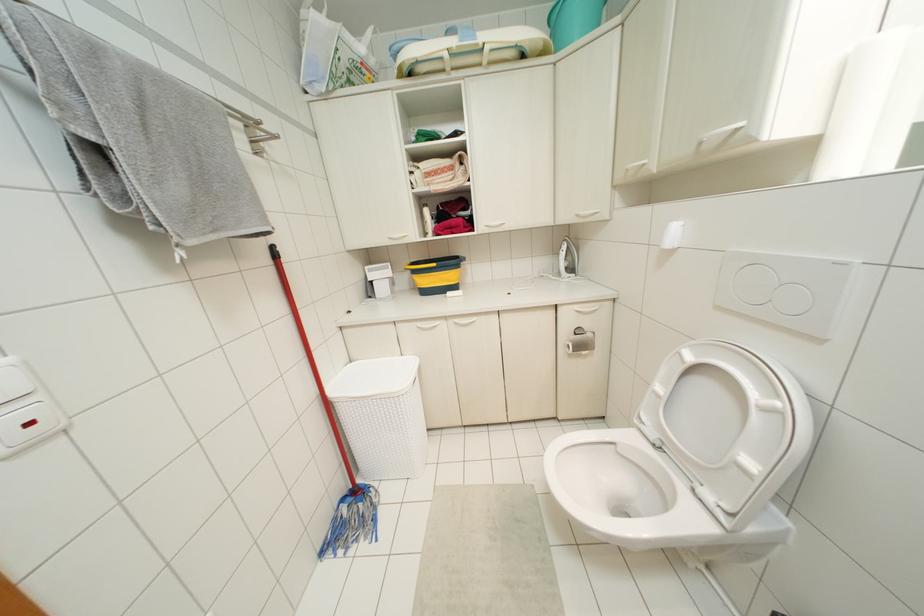
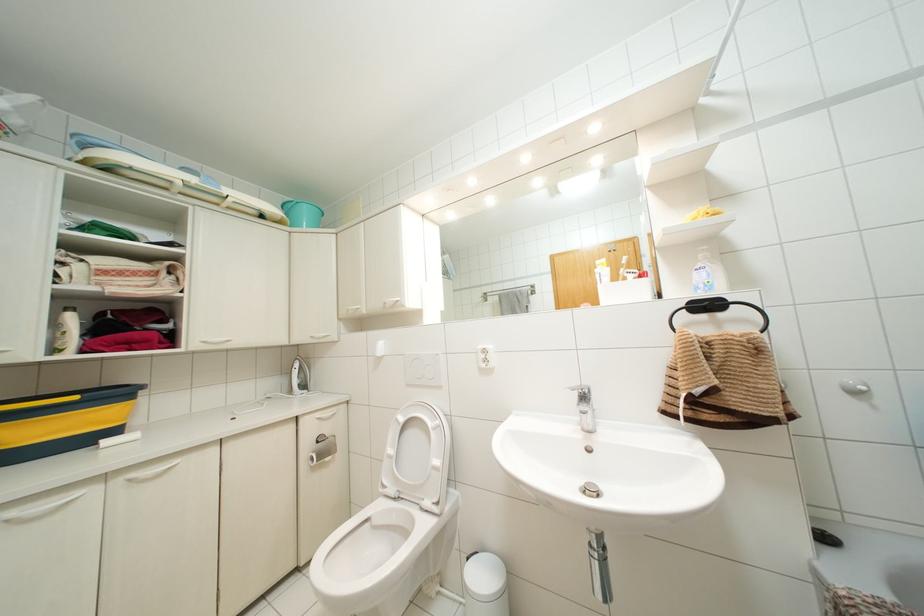
In the second image, find the point that corresponds to point 736,129 in the first image.

(396, 301)